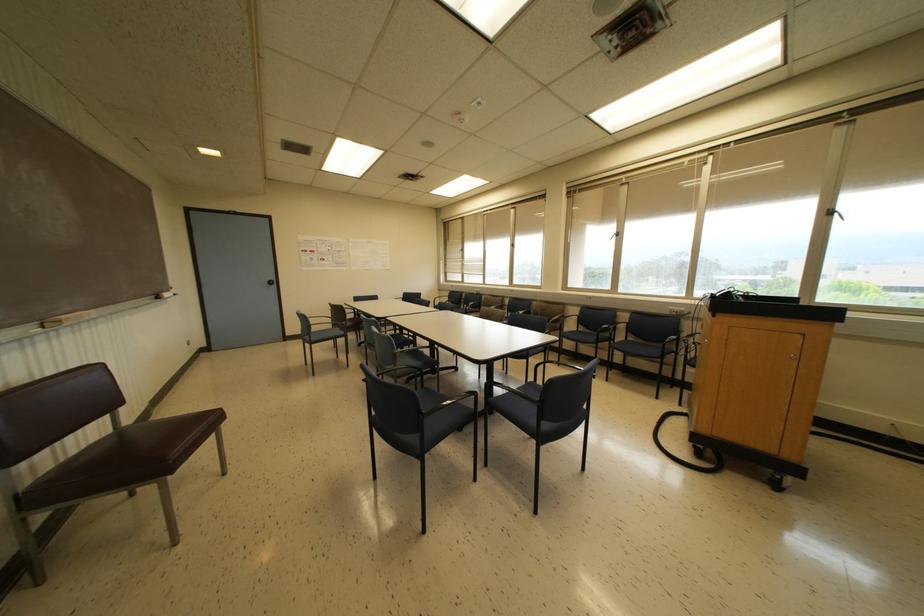
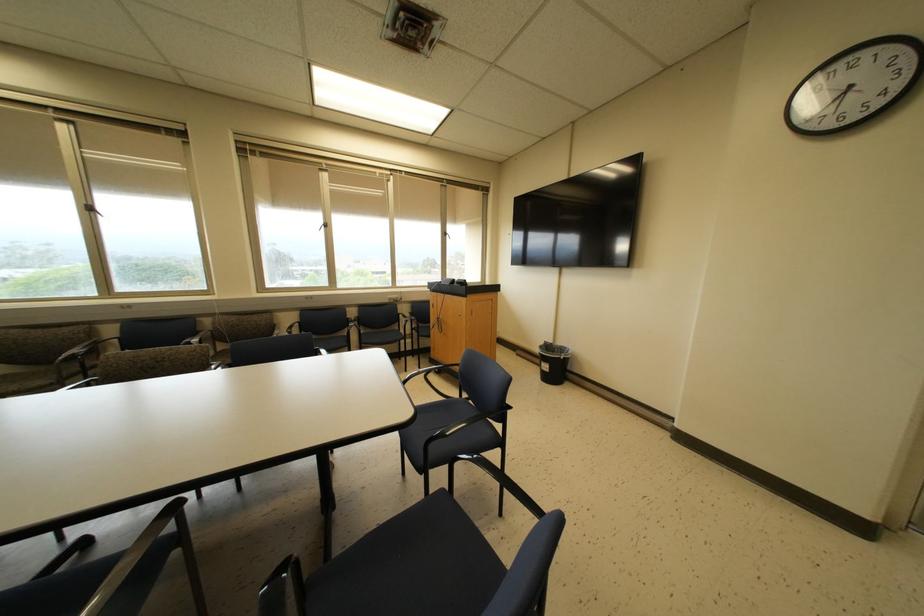
Where in the second image is the point corresponding to pixel 512 245 from the first image?

(89, 208)